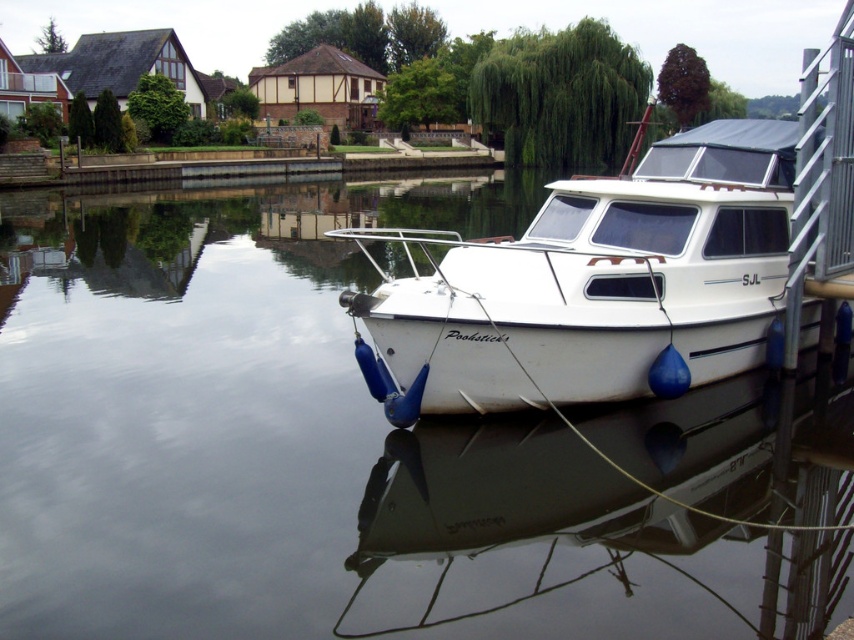
Question: Is smooth water at boat right above white matte boat at right?

Choices:
 (A) no
 (B) yes

Answer: (A)

Question: Which point is farther from the camera taking this photo?

Choices:
 (A) (653, 202)
 (B) (223, 493)

Answer: (A)

Question: Which of the following is the farthest from the observer?

Choices:
 (A) smooth water at boat right
 (B) white matte boat at right

Answer: (B)

Question: Is the position of smooth water at boat right less distant than that of white matte boat at right?

Choices:
 (A) no
 (B) yes

Answer: (B)

Question: Which object is farther from the camera taking this photo?

Choices:
 (A) white matte boat at right
 (B) smooth water at boat right

Answer: (A)

Question: Does smooth water at boat right appear on the left side of white matte boat at right?

Choices:
 (A) yes
 (B) no

Answer: (A)